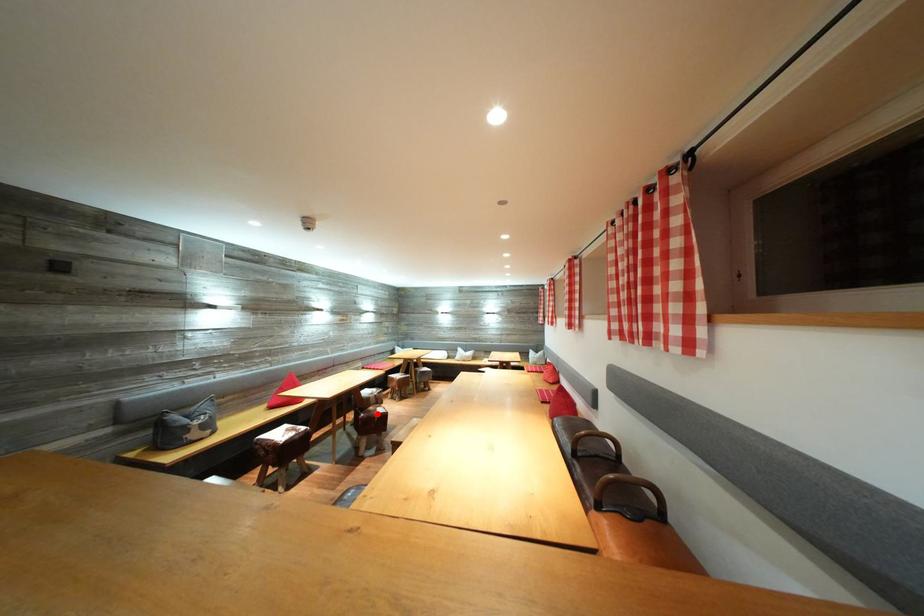
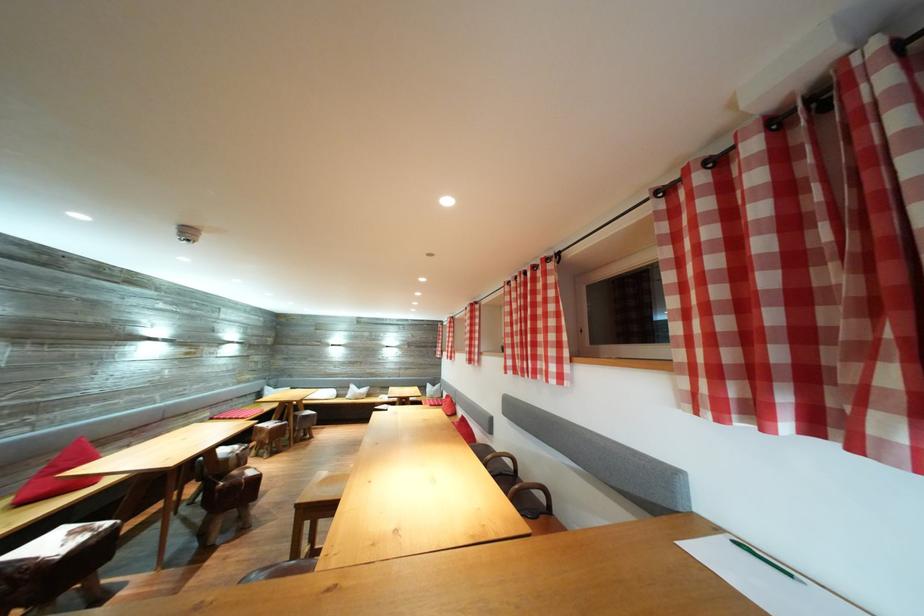
Locate, in the second image, the point that corresponds to the highlighted location in the first image.

(241, 477)